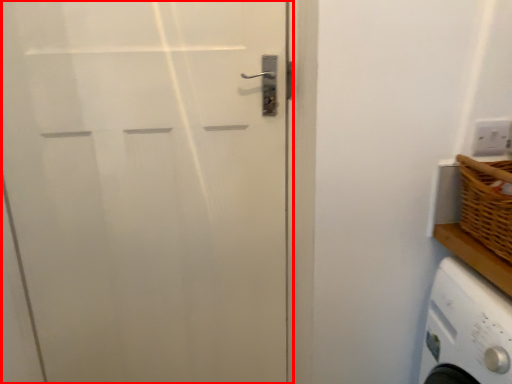
Question: Considering the relative positions of door (annotated by the red box) and electric outlet in the image provided, where is door (annotated by the red box) located with respect to the staircase?

Choices:
 (A) left
 (B) right

Answer: (A)